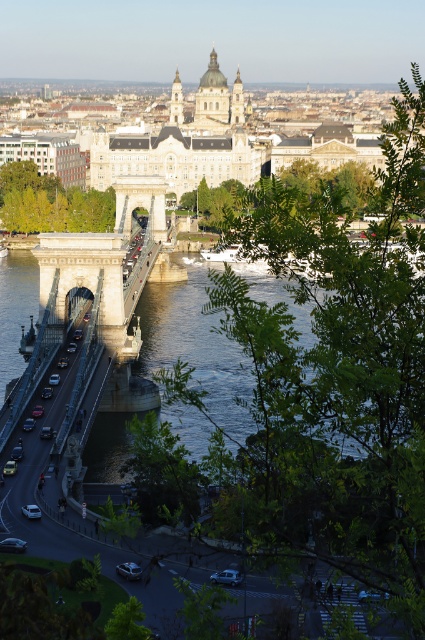
You are a photographer planning to take a photo of the clear water at center and the shiny silver car at left. Based on their positions, which object will appear closer to the camera in the final image?

The clear water at center appears closer to the camera because it is positioned in front of the shiny silver car at left.

You are a tourist standing on the riverbank and want to take a photo of the shiny silver car at left and the clear water at center. Which object should you point your camera towards first if you want to capture both in one shot?

You should point your camera towards the shiny silver car at left first because the clear water at center is to the right of the shiny silver car at left, so capturing the car first allows the water to be included to its right in the frame.